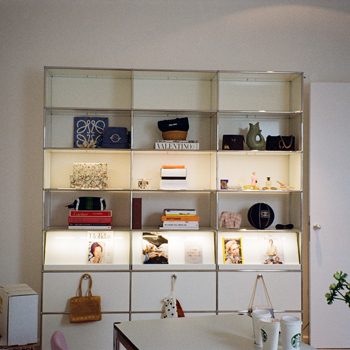
Where is `three starbucks cups`? three starbucks cups is located at coordinates (259, 324), (271, 331), (295, 336).